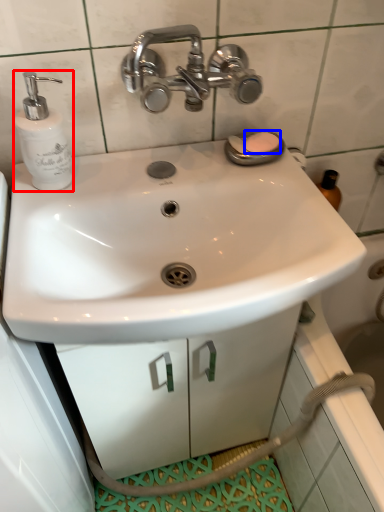
Question: Which of the following is the closest to the observer, soap dispenser (highlighted by a red box) or soap (highlighted by a blue box)?

Choices:
 (A) soap dispenser
 (B) soap

Answer: (A)